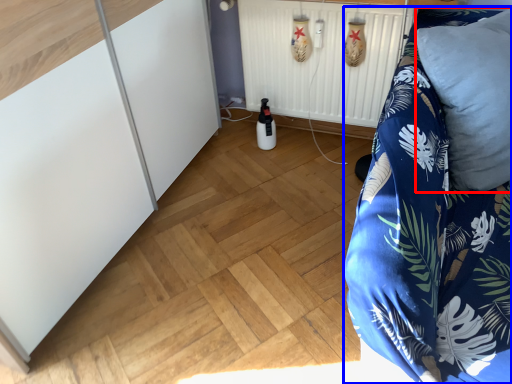
Question: Among these objects, which one is farthest to the camera, pillow (highlighted by a red box) or furniture (highlighted by a blue box)?

Choices:
 (A) pillow
 (B) furniture

Answer: (A)